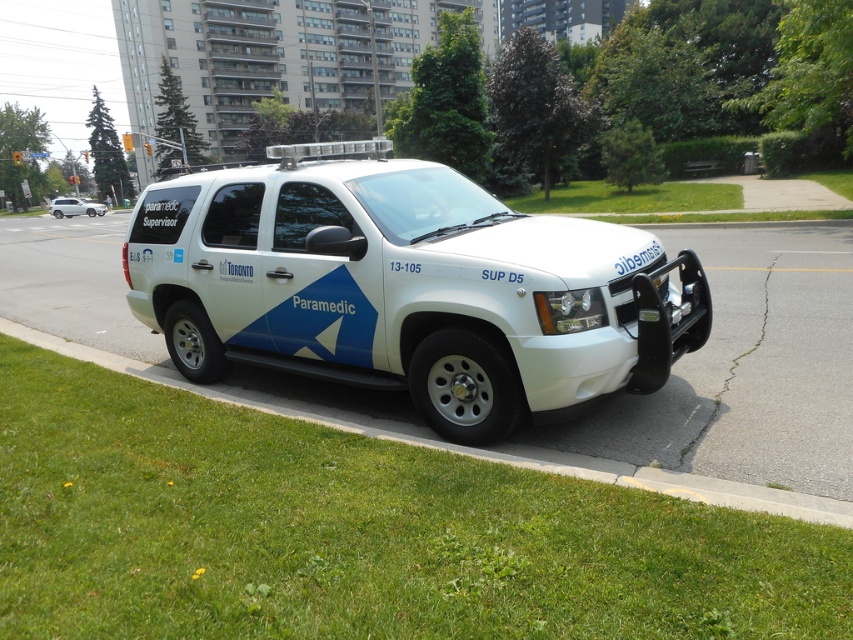
You are a pedestrian standing on the sidewalk and see the green grass at lower left and the white matte suv at center. Which object is closer to the ground?

The green grass at lower left is closer to the ground as it is positioned below the white matte suv at center.

You are a pedestrian standing on the sidewalk across the road from the white matte suv at center and the white matte paramedic vehicle at center. Which vehicle is closer to you?

The white matte suv at center is closer to you because it is in front of the white matte paramedic vehicle at center, meaning it is positioned nearer to your location on the sidewalk.